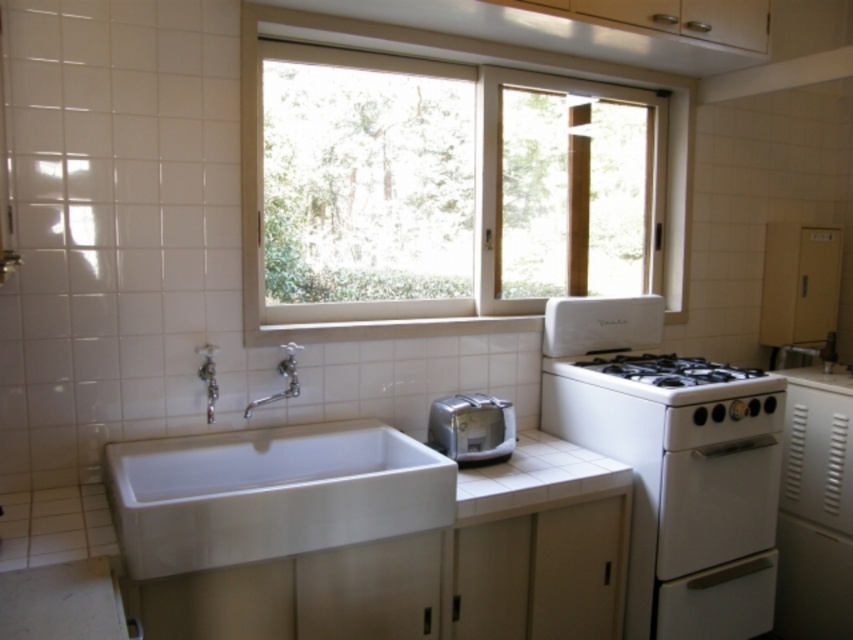
Is point (222, 529) closer to camera compared to point (450, 436)?

Yes, it is in front of point (450, 436).

Consider the image. Can you confirm if white ceramic sink at lower left is wider than satin silver toaster at lower center?

Indeed, white ceramic sink at lower left has a greater width compared to satin silver toaster at lower center.

Measure the distance between point (283,452) and camera.

The distance of point (283,452) from camera is 6.60 feet.

The height and width of the screenshot is (640, 853). Identify the location of white ceramic sink at lower left. (270, 493).

Which is more to the right, white glossy stove at right or white glossy gas stove at right?

white glossy gas stove at right

Which is in front, point (583, 410) or point (688, 381)?

Point (688, 381) is in front.

This screenshot has height=640, width=853. I want to click on white glossy stove at right, so click(672, 464).

Is the position of white plastic window at upper center more distant than that of silver metallic faucet at sink left?

Yes.

Find the location of a particular element. white plastic window at upper center is located at coordinates (480, 68).